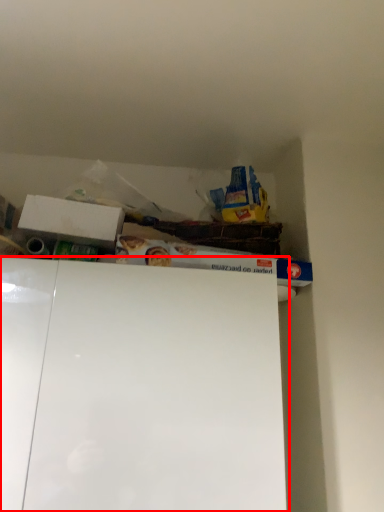
Question: Where is cabinet (annotated by the red box) located in relation to box in the image?

Choices:
 (A) left
 (B) right

Answer: (B)